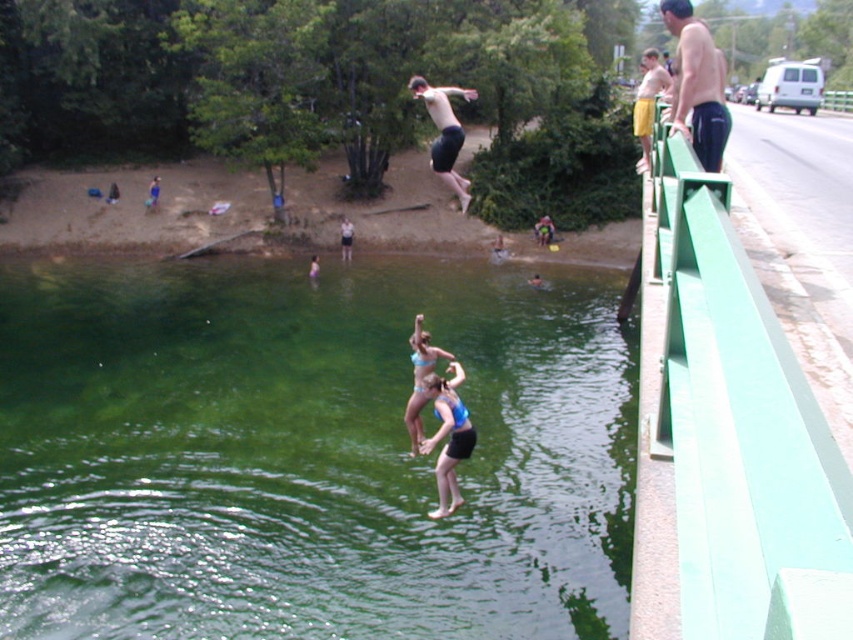
Question: Which object is positioned closest to the green translucent water at center?

Choices:
 (A) blue fabric shorts at center
 (B) skinny jeans at right

Answer: (A)

Question: Which object is the farthest from the green translucent water at center?

Choices:
 (A) skinny jeans at right
 (B) blue fabric shorts at center

Answer: (A)

Question: Does green translucent water at center have a greater width compared to blue fabric shorts at center?

Choices:
 (A) yes
 (B) no

Answer: (A)

Question: Which object appears farthest from the camera in this image?

Choices:
 (A) skinny jeans at right
 (B) green translucent water at center

Answer: (B)

Question: Is skinny jeans at right to the left of blue fabric shorts at center from the viewer's perspective?

Choices:
 (A) no
 (B) yes

Answer: (A)

Question: Is skinny jeans at right thinner than blue fabric shorts at center?

Choices:
 (A) yes
 (B) no

Answer: (B)